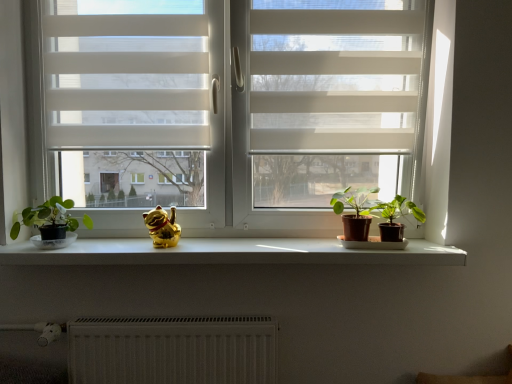
At what (x,y) coordinates should I click in order to perform the action: click on vacant area located to the right-hand side of gold shiny cat at center. Please return your answer as a coordinate pair (x, y). This screenshot has width=512, height=384. Looking at the image, I should click on (209, 245).